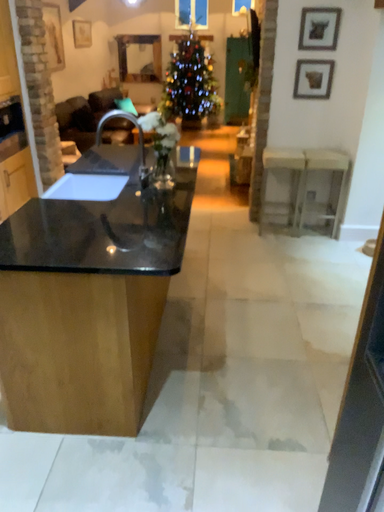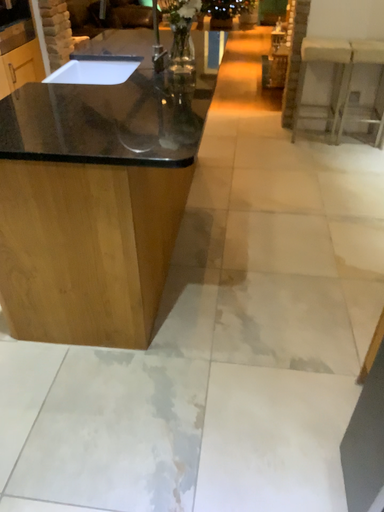
Question: Which way did the camera rotate in the video?

Choices:
 (A) rotated downward
 (B) rotated upward

Answer: (A)